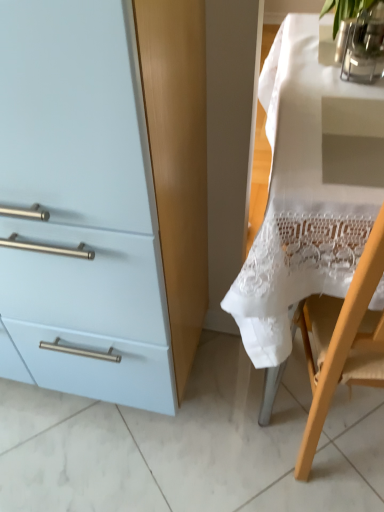
Locate an element on the screen. The width and height of the screenshot is (384, 512). vacant space that is to the left of clear glass vase at upper right, the 2th glass vase from the front is located at coordinates (291, 63).